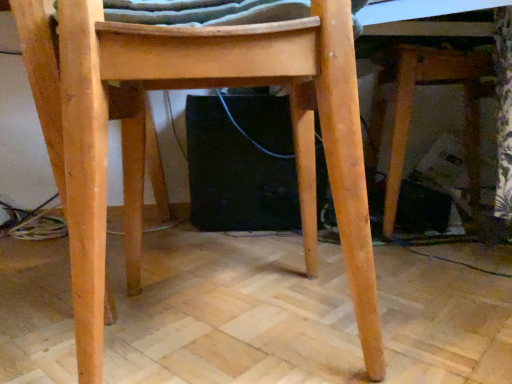
Question: Does natural wood chair at center have a greater width compared to natural wood table at lower right?

Choices:
 (A) yes
 (B) no

Answer: (B)

Question: Is natural wood chair at center completely or partially outside of natural wood table at lower right?

Choices:
 (A) yes
 (B) no

Answer: (A)

Question: From the image's perspective, is natural wood chair at center beneath natural wood table at lower right?

Choices:
 (A) yes
 (B) no

Answer: (A)

Question: Considering the relative sizes of natural wood chair at center and natural wood table at lower right in the image provided, is natural wood chair at center smaller than natural wood table at lower right?

Choices:
 (A) no
 (B) yes

Answer: (B)

Question: Does natural wood chair at center touch natural wood table at lower right?

Choices:
 (A) yes
 (B) no

Answer: (B)

Question: Can you confirm if natural wood chair at center is taller than natural wood table at lower right?

Choices:
 (A) yes
 (B) no

Answer: (B)

Question: Considering the relative sizes of natural wood table at lower right and natural wood chair at center in the image provided, is natural wood table at lower right thinner than natural wood chair at center?

Choices:
 (A) yes
 (B) no

Answer: (B)

Question: Is natural wood table at lower right aimed at natural wood chair at center?

Choices:
 (A) no
 (B) yes

Answer: (A)

Question: Is natural wood table at lower right shorter than natural wood chair at center?

Choices:
 (A) yes
 (B) no

Answer: (B)

Question: Is natural wood chair at center a part of natural wood table at lower right?

Choices:
 (A) yes
 (B) no

Answer: (B)

Question: From the image's perspective, is natural wood table at lower right located above natural wood chair at center?

Choices:
 (A) yes
 (B) no

Answer: (A)

Question: Does natural wood table at lower right have a greater width compared to natural wood chair at center?

Choices:
 (A) yes
 (B) no

Answer: (A)

Question: Is point [x=467, y=132] closer or farther from the camera than point [x=105, y=33]?

Choices:
 (A) closer
 (B) farther

Answer: (B)